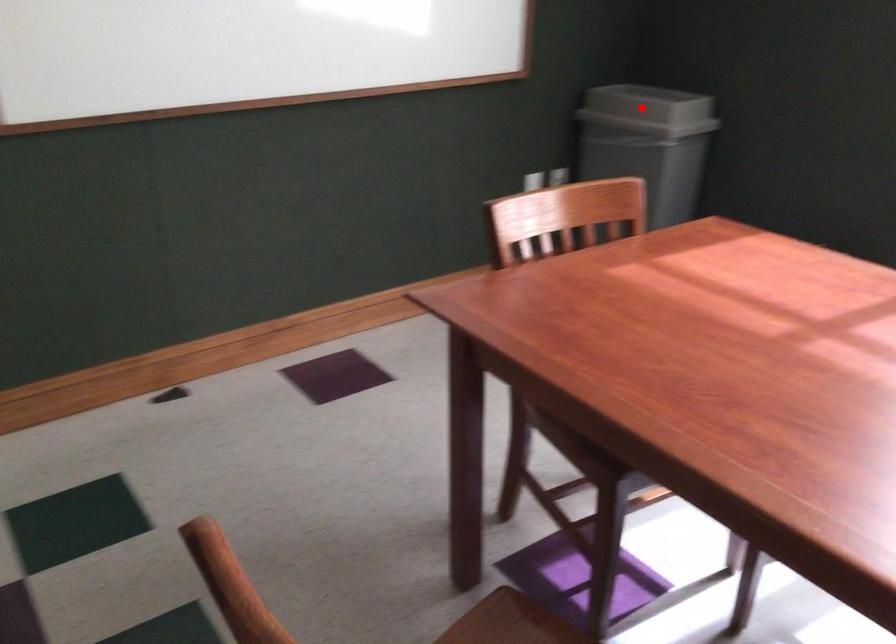
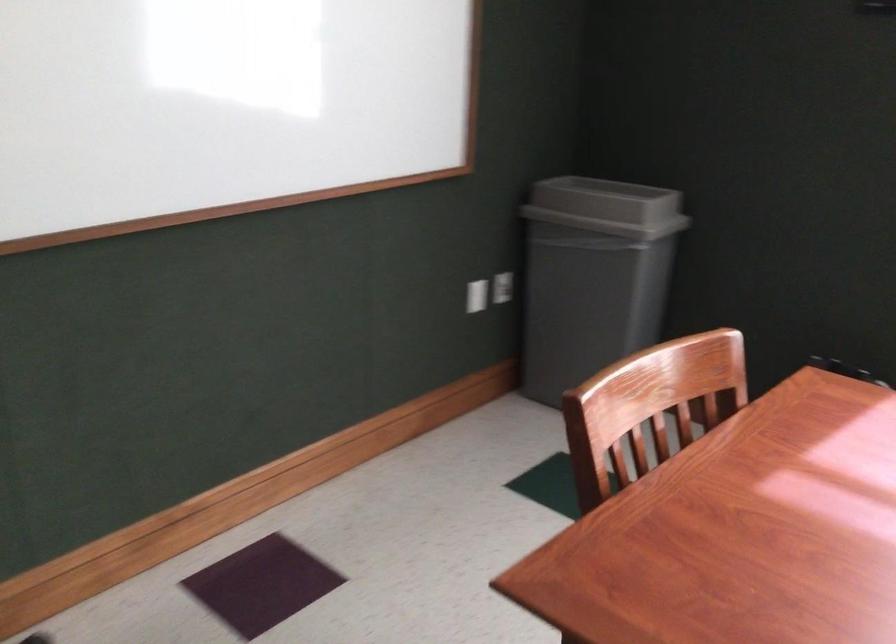
Question: I am providing you with two images of the same scene from different viewpoints. Given a red point in image1, look at the same physical point in image2. Is it:

Choices:
 (A) Closer to the viewpoint
 (B) Farther from the viewpoint

Answer: (A)